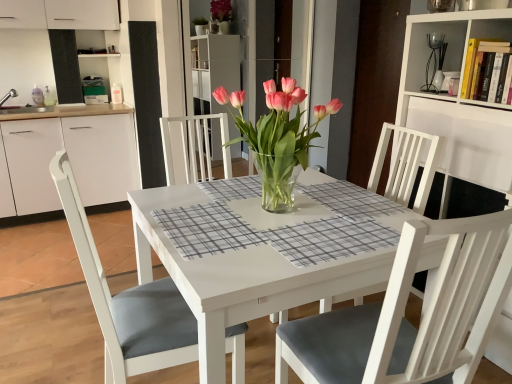
Identify the location of pink glass vase at center. (277, 138).

Find the location of `white wood bookshelf at upper right`. white wood bookshelf at upper right is located at coordinates (458, 101).

Image resolution: width=512 pixels, height=384 pixels. What do you see at coordinates (485, 35) in the screenshot?
I see `hardcover books at upper right` at bounding box center [485, 35].

The image size is (512, 384). Describe the element at coordinates (407, 320) in the screenshot. I see `white wood chair at center` at that location.

You are a GUI agent. You are given a task and a screenshot of the screen. Output one action in this format:
    pyautogui.click(x=<x>, y=<y>)
    Task: Click on the pink glass vase at center
    
    Given the screenshot: What is the action you would take?
    pyautogui.click(x=277, y=138)

Which object is further away from the camera taking this photo, white wood bookshelf at upper right or hardcover books at upper right?

Positioned behind is hardcover books at upper right.

Considering the relative sizes of white wood bookshelf at upper right and hardcover books at upper right in the image provided, is white wood bookshelf at upper right bigger than hardcover books at upper right?

Yes, white wood bookshelf at upper right is bigger than hardcover books at upper right.

Looking at their sizes, would you say white wood bookshelf at upper right is wider or thinner than hardcover books at upper right?

In the image, white wood bookshelf at upper right appears to be wider than hardcover books at upper right.

Is pink glass vase at center completely or partially outside of white glossy table at center?

Indeed, pink glass vase at center is completely outside white glossy table at center.

From the image's perspective, which object appears higher, pink glass vase at center or white glossy table at center?

pink glass vase at center is shown above in the image.

Based on the photo, is pink glass vase at center far away from white glossy table at center?

No, there isn't a large distance between pink glass vase at center and white glossy table at center.

In terms of height, does pink glass vase at center look taller or shorter compared to white glossy table at center?

Considering their sizes, pink glass vase at center has less height than white glossy table at center.

Can you confirm if hardcover books at upper right is thinner than white wood chair at center?

Yes, hardcover books at upper right is thinner than white wood chair at center.

Considering the positions of objects hardcover books at upper right and white wood chair at center in the image provided, who is behind, hardcover books at upper right or white wood chair at center?

hardcover books at upper right is further away from the camera.

Does hardcover books at upper right appear on the right side of white wood chair at center?

Yes.

From a real-world perspective, who is located higher, hardcover books at upper right or white wood chair at center?

hardcover books at upper right.

From a real-world perspective, relative to pink glass vase at center, is white wood bookshelf at upper right vertically above or below?

Clearly, from a real-world perspective, white wood bookshelf at upper right is below pink glass vase at center.

Considering their positions, is white wood bookshelf at upper right located in front of or behind pink glass vase at center?

Clearly, white wood bookshelf at upper right is behind pink glass vase at center.

Is white wood bookshelf at upper right oriented away from pink glass vase at center?

No, white wood bookshelf at upper right's orientation is not away from pink glass vase at center.

Is white wood bookshelf at upper right far away from pink glass vase at center?

No, white wood bookshelf at upper right is in close proximity to pink glass vase at center.

Between point (420, 381) and point (490, 32), which one is positioned behind?

The point (490, 32) is farther.

Would you say white wood chair at center is a long distance from hardcover books at upper right?

Indeed, white wood chair at center is not near hardcover books at upper right.

What's the angular difference between white wood chair at center and hardcover books at upper right's facing directions?

white wood chair at center and hardcover books at upper right are facing 4.38 degrees away from each other.

Considering the sizes of pink glass vase at center and white wood bookshelf at upper right in the image, is pink glass vase at center bigger or smaller than white wood bookshelf at upper right?

Considering their sizes, pink glass vase at center takes up less space than white wood bookshelf at upper right.

What's the angular difference between pink glass vase at center and white wood bookshelf at upper right's facing directions?

The angle between the facing direction of pink glass vase at center and the facing direction of white wood bookshelf at upper right is 0.656 degrees.

Would you say white wood bookshelf at upper right is part of pink glass vase at center's contents?

No, pink glass vase at center does not contain white wood bookshelf at upper right.

Does pink glass vase at center have a lesser width compared to white wood bookshelf at upper right?

No.

Could you tell me if white wood chair at center is turned towards white wood bookshelf at upper right?

No, white wood chair at center is not turned towards white wood bookshelf at upper right.

Find the location of `bookshelf on the right of white wood chair at center`. bookshelf on the right of white wood chair at center is located at coordinates (458, 101).

Which object is positioned more to the left, white wood chair at center or white wood bookshelf at upper right?

From the viewer's perspective, white wood chair at center appears more on the left side.

From a real-world perspective, is white wood chair at center physically above white wood bookshelf at upper right?

No, from a real-world perspective, white wood chair at center is not over white wood bookshelf at upper right

This screenshot has height=384, width=512. In the image, there is a hardcover books at upper right. Find the location of `bookshelf below it (from the image's perspective)`. bookshelf below it (from the image's perspective) is located at coordinates (458, 101).

The height and width of the screenshot is (384, 512). Identify the location of floral arrangement on the right of white glossy table at center. (277, 138).

Looking at the image, which one is located further to pink glass vase at center, hardcover books at upper right or white glossy table at center?

Among the two, hardcover books at upper right is located further to pink glass vase at center.

Which object lies nearer to the anchor point hardcover books at upper right, white wood chair at center or pink glass vase at center?

pink glass vase at center.

Based on their spatial positions, is white glossy table at center or pink glass vase at center closer to white wood chair at center?

white glossy table at center lies closer to white wood chair at center than the other object.

Considering their positions, is white wood bookshelf at upper right positioned closer to hardcover books at upper right than white wood chair at center?

white wood bookshelf at upper right lies closer to hardcover books at upper right than the other object.

Considering their positions, is white glossy table at center positioned closer to white wood chair at center than white wood bookshelf at upper right?

The object closer to white wood chair at center is white glossy table at center.

Estimate the real-world distances between objects in this image. Which object is further from white wood bookshelf at upper right, pink glass vase at center or white wood chair at center?

white wood chair at center.

Considering their positions, is white glossy table at center positioned closer to pink glass vase at center than white wood bookshelf at upper right?

white glossy table at center is positioned closer to the anchor pink glass vase at center.

Estimate the real-world distances between objects in this image. Which object is further from white wood chair at center, white glossy table at center or hardcover books at upper right?

hardcover books at upper right is further to white wood chair at center.

Where is `chair that lies between pink glass vase at center and white glossy table at center from top to bottom`? The height and width of the screenshot is (384, 512). chair that lies between pink glass vase at center and white glossy table at center from top to bottom is located at coordinates [x=407, y=320].

Where is `shelf between pink glass vase at center and white wood bookshelf at upper right`? The width and height of the screenshot is (512, 384). shelf between pink glass vase at center and white wood bookshelf at upper right is located at coordinates (x=485, y=35).

The height and width of the screenshot is (384, 512). What are the coordinates of `chair between white glossy table at center and white wood bookshelf at upper right from left to right` in the screenshot? It's located at (407, 320).

Image resolution: width=512 pixels, height=384 pixels. In order to click on bookshelf between hardcover books at upper right and white wood chair at center in the up-down direction in this screenshot , I will do `click(458, 101)`.